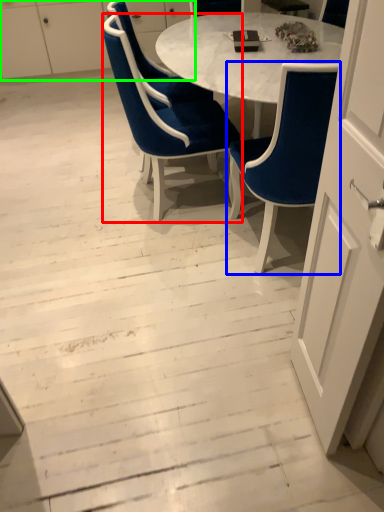
Question: Which object is positioned closest to chair (highlighted by a red box)? Select from chair (highlighted by a blue box) and dresser (highlighted by a green box).

Choices:
 (A) chair
 (B) dresser

Answer: (A)